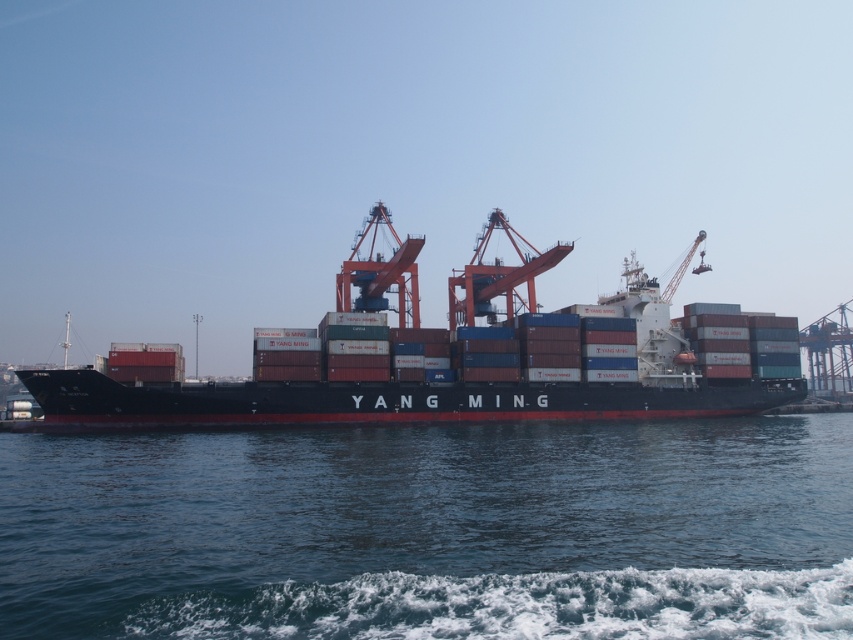
Question: Which object is farther from the camera taking this photo?

Choices:
 (A) blue water at lower center
 (B) black matte container ship at center

Answer: (B)

Question: Which of the following is the closest to the observer?

Choices:
 (A) (660, 349)
 (B) (548, 545)

Answer: (B)

Question: Does blue water at lower center have a larger size compared to black matte container ship at center?

Choices:
 (A) no
 (B) yes

Answer: (A)

Question: Can you confirm if blue water at lower center is wider than black matte container ship at center?

Choices:
 (A) no
 (B) yes

Answer: (A)

Question: Considering the relative positions of blue water at lower center and black matte container ship at center in the image provided, where is blue water at lower center located with respect to black matte container ship at center?

Choices:
 (A) above
 (B) below

Answer: (B)